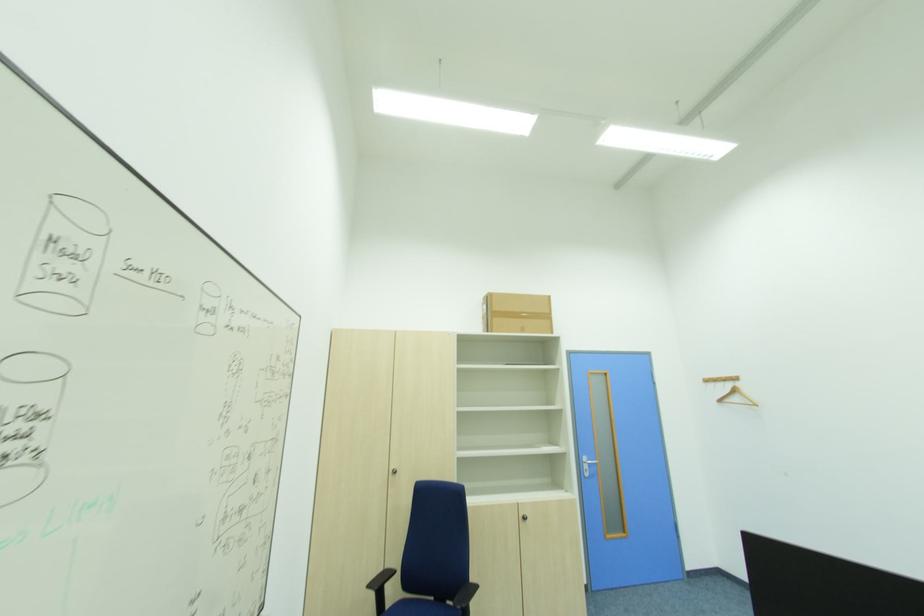
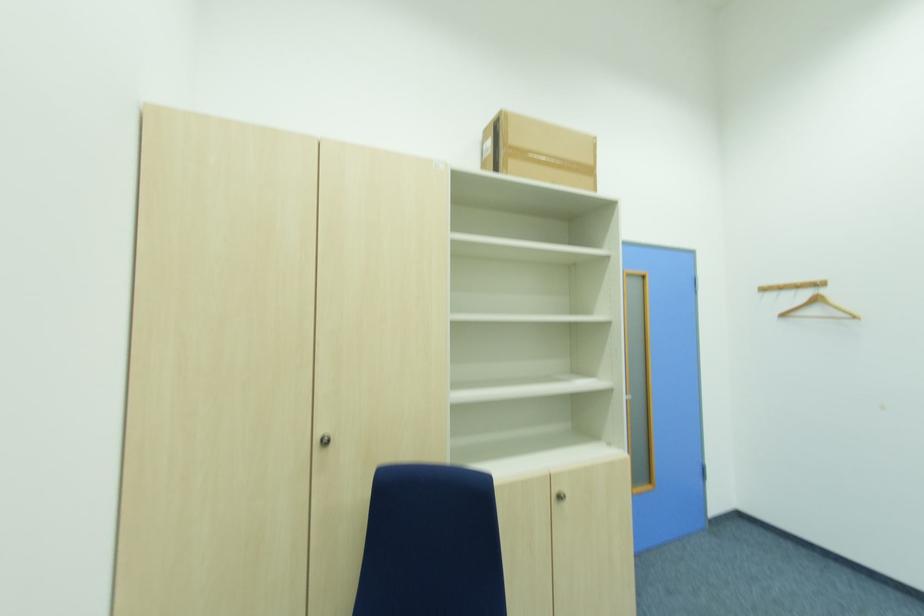
Find the pixel in the second image that matches pixel 499 314 in the first image.

(515, 150)